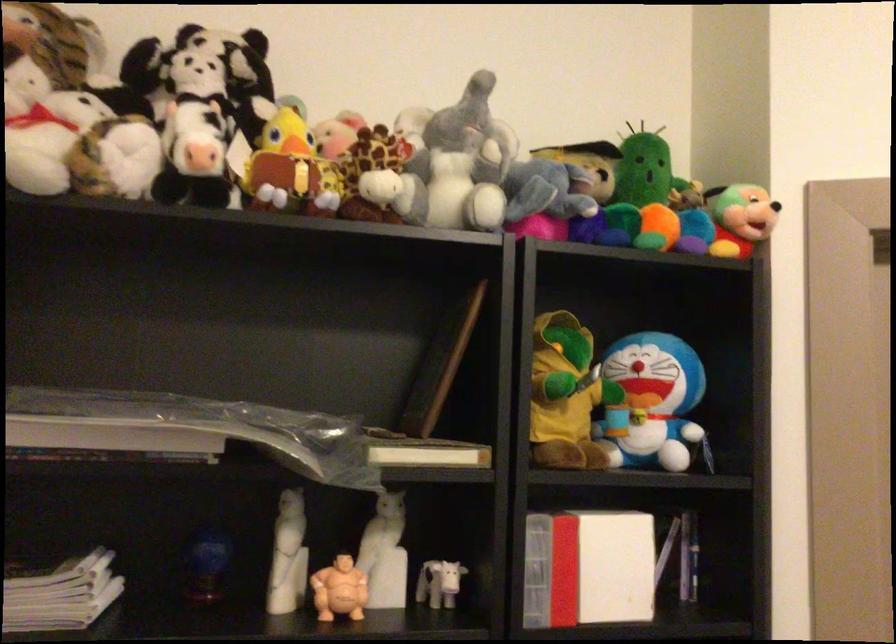
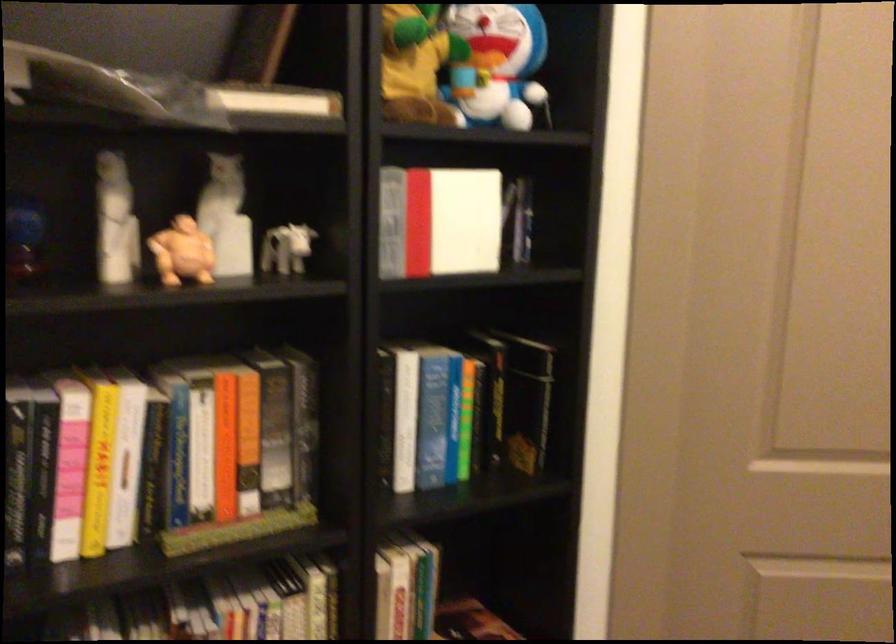
The first image is from the beginning of the video and the second image is from the end. How did the camera likely rotate when shooting the video?

The camera's rotation is toward right-down.